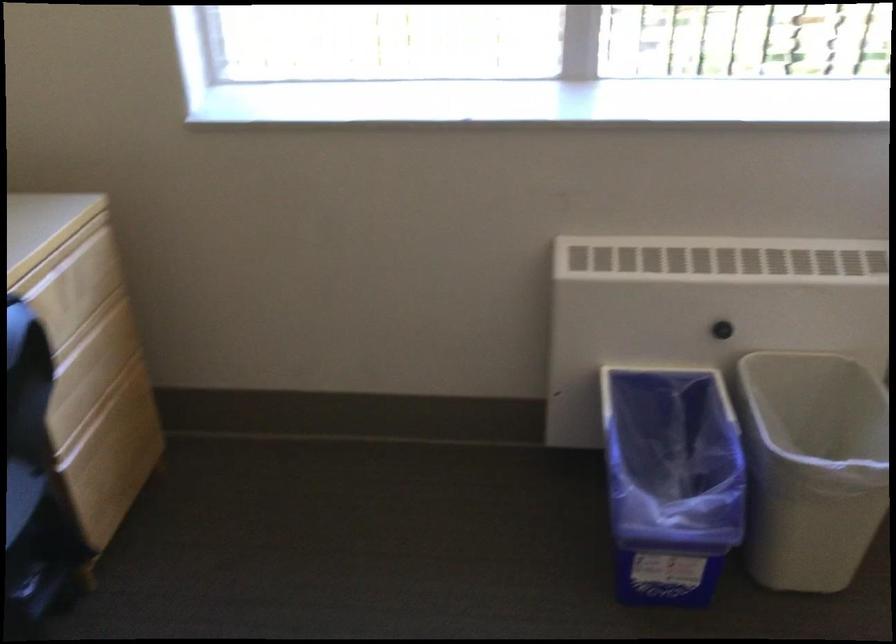
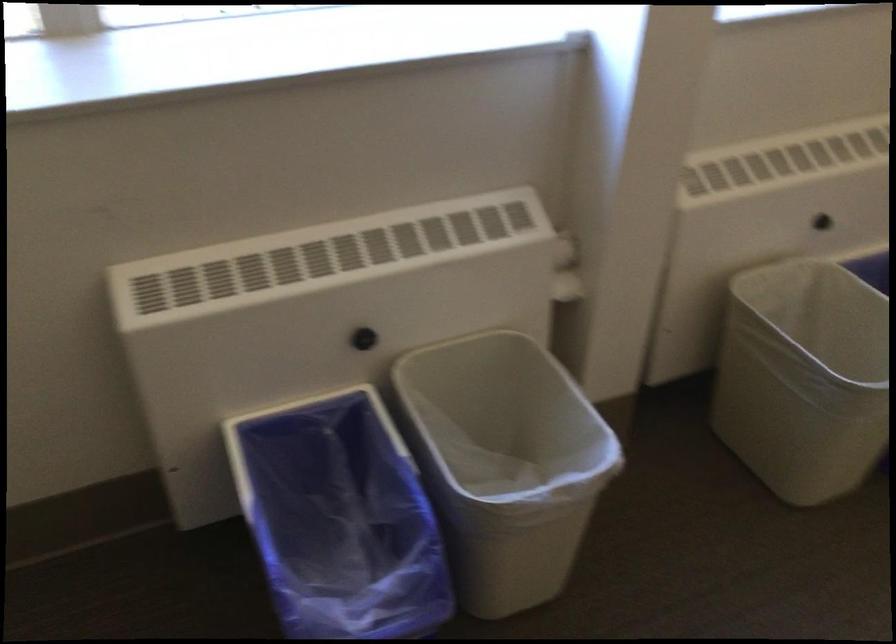
Question: The first image is from the beginning of the video and the second image is from the end. How did the camera likely rotate when shooting the video?

Choices:
 (A) Left
 (B) Right
 (C) Up
 (D) Down

Answer: (B)